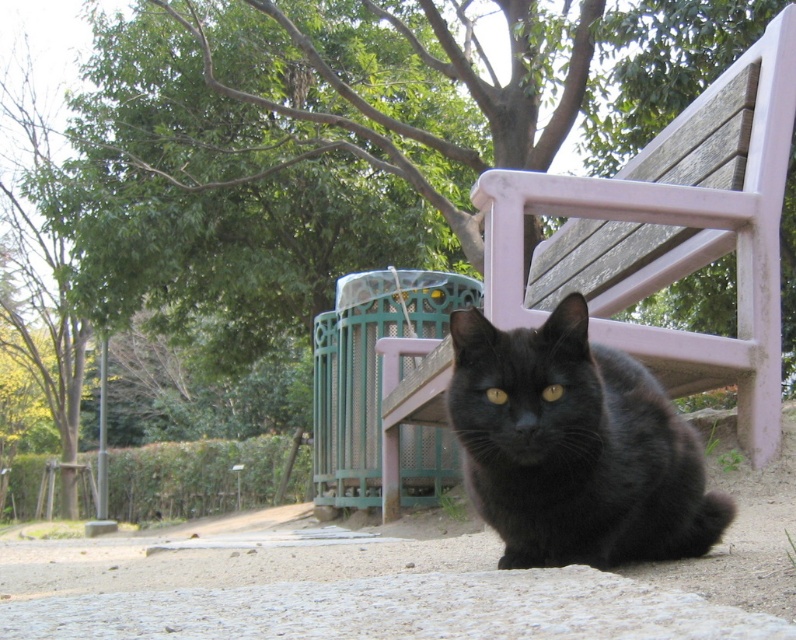
Question: Which point is closer to the camera taking this photo?

Choices:
 (A) (622, 285)
 (B) (650, 516)

Answer: (B)

Question: Does wooden park bench at center appear over black fur cat at center?

Choices:
 (A) no
 (B) yes

Answer: (B)

Question: Is wooden park bench at center behind black fur cat at center?

Choices:
 (A) yes
 (B) no

Answer: (A)

Question: Observing the image, what is the correct spatial positioning of wooden park bench at center in reference to black fur cat at center?

Choices:
 (A) above
 (B) below

Answer: (A)

Question: Which point appears farthest from the camera in this image?

Choices:
 (A) (769, 29)
 (B) (587, 472)

Answer: (A)

Question: Among these objects, which one is nearest to the camera?

Choices:
 (A) wooden park bench at center
 (B) black fur cat at center

Answer: (B)